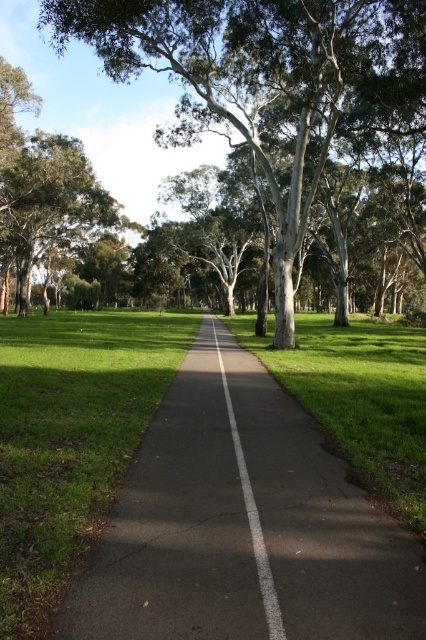
Question: Which object appears farthest from the camera in this image?

Choices:
 (A) green leafy tree at upper left
 (B) white asphalt path at center
 (C) black asphalt path at center

Answer: (A)

Question: Does black asphalt path at center have a lesser width compared to green leafy tree at upper left?

Choices:
 (A) no
 (B) yes

Answer: (B)

Question: Which of the following is the closest to the observer?

Choices:
 (A) (83, 182)
 (B) (264, 566)
 (C) (270, 196)

Answer: (B)

Question: Is black asphalt path at center closer to the viewer compared to white asphalt path at center?

Choices:
 (A) yes
 (B) no

Answer: (A)

Question: Which point is closer to the camera taking this photo?

Choices:
 (A) (288, 52)
 (B) (14, 163)
 (C) (328, 458)

Answer: (C)

Question: Does green leafy tree at center appear over white asphalt path at center?

Choices:
 (A) yes
 (B) no

Answer: (A)